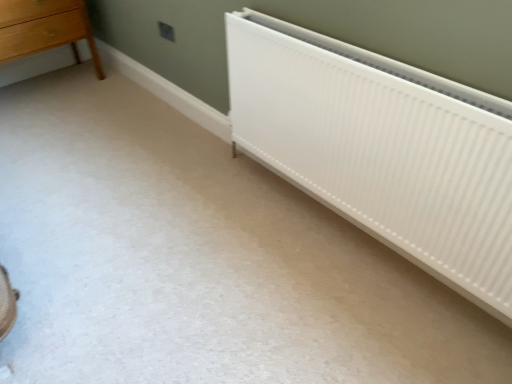
Question: In terms of size, does white ribbed radiator at lower right appear bigger or smaller than light brown wooden chest of drawers at upper left?

Choices:
 (A) small
 (B) big

Answer: (A)

Question: From a real-world perspective, is white ribbed radiator at lower right physically located above or below light brown wooden chest of drawers at upper left?

Choices:
 (A) below
 (B) above

Answer: (B)

Question: From the image's perspective, relative to light brown wooden chest of drawers at upper left, is white ribbed radiator at lower right above or below?

Choices:
 (A) below
 (B) above

Answer: (A)

Question: Is light brown wooden chest of drawers at upper left situated inside white ribbed radiator at lower right or outside?

Choices:
 (A) outside
 (B) inside

Answer: (A)

Question: Would you say light brown wooden chest of drawers at upper left is to the left or to the right of white ribbed radiator at lower right in the picture?

Choices:
 (A) right
 (B) left

Answer: (B)

Question: Considering the positions of point (25, 18) and point (267, 139), is point (25, 18) closer or farther from the camera than point (267, 139)?

Choices:
 (A) farther
 (B) closer

Answer: (A)

Question: Considering the positions of light brown wooden chest of drawers at upper left and white ribbed radiator at lower right in the image, is light brown wooden chest of drawers at upper left taller or shorter than white ribbed radiator at lower right?

Choices:
 (A) tall
 (B) short

Answer: (B)